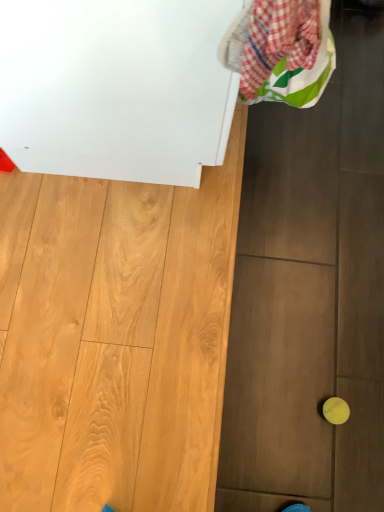
Image resolution: width=384 pixels, height=512 pixels. What are the coordinates of `free location in front of white glossy cabinet at upper left` in the screenshot? It's located at (144, 303).